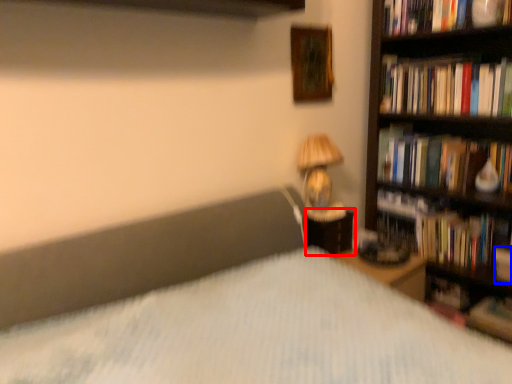
Question: Which object is closer to the camera taking this photo, nightstand (highlighted by a red box) or paperback book (highlighted by a blue box)?

Choices:
 (A) nightstand
 (B) paperback book

Answer: (B)